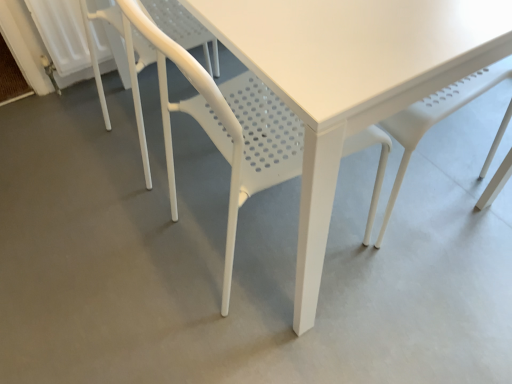
You are a GUI agent. You are given a task and a screenshot of the screen. Output one action in this format:
    pyautogui.click(x=<x>, y=<y>)
    Task: Click on the free space in front of white plastic chair at lower left, which is the 2th chair in right-to-left order
    This screenshot has height=384, width=512.
    Given the screenshot: What is the action you would take?
    pyautogui.click(x=136, y=221)